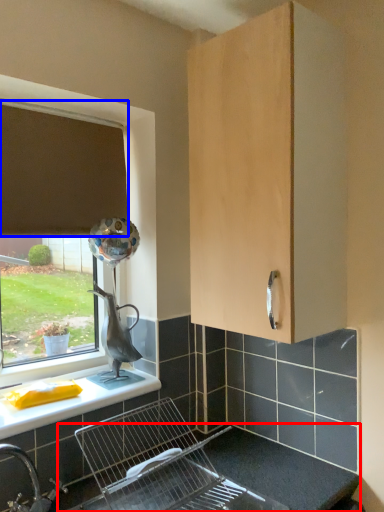
Question: Which object appears closest to the camera in this image, counter top (highlighted by a red box) or curtain (highlighted by a blue box)?

Choices:
 (A) counter top
 (B) curtain

Answer: (A)